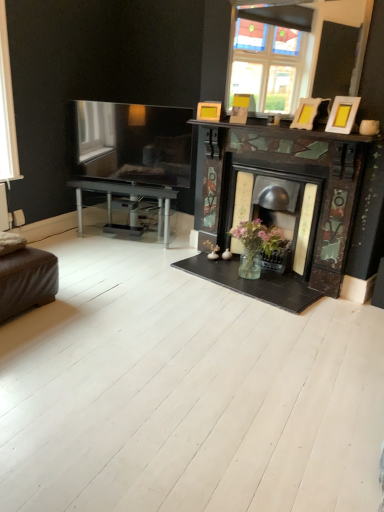
Question: From their relative heights in the image, would you say matte yellow picture frame at upper right, marked as the 1th picture frame in a left-to-right arrangement, is taller or shorter than transparent glass window at left?

Choices:
 (A) tall
 (B) short

Answer: (B)

Question: Is matte yellow picture frame at upper right, acting as the 3th picture frame starting from the front, inside or outside of transparent glass window at left?

Choices:
 (A) outside
 (B) inside

Answer: (A)

Question: Which object is the closest to the matte gold picture frame at upper right, which appears as the third picture frame when viewed from the left?

Choices:
 (A) transparent glass window at left
 (B) brown leather ottoman at lower left
 (C) wooden photo frame at upper right, positioned as the 2th picture frame in back-to-front order
 (D) matte yellow picture frame at upper right, acting as the 3th picture frame starting from the front

Answer: (C)

Question: Which is nearer to the matte gold picture frame at upper right, marked as the first picture frame in a right-to-left arrangement?

Choices:
 (A) brown leather ottoman at lower left
 (B) transparent glass window at left
 (C) matte yellow picture frame at upper right, acting as the 3th picture frame starting from the front
 (D) wooden photo frame at upper right, which is the 2th picture frame from left to right

Answer: (D)